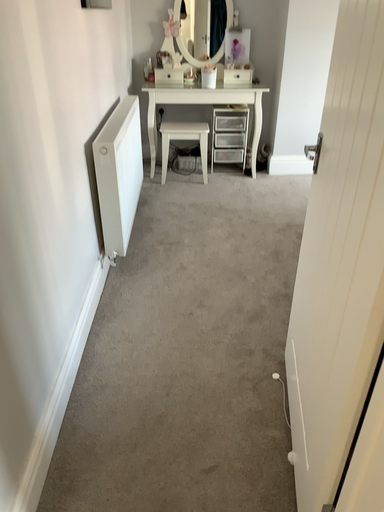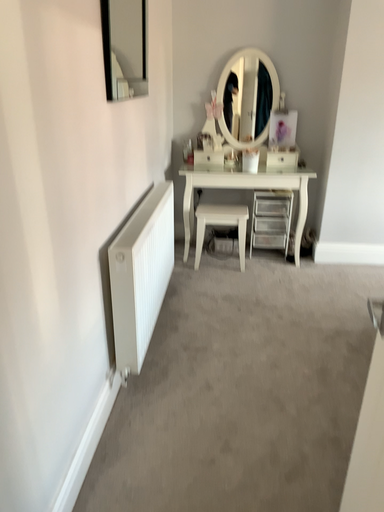
Question: How did the camera likely rotate when shooting the video?

Choices:
 (A) rotated upward
 (B) rotated downward

Answer: (A)